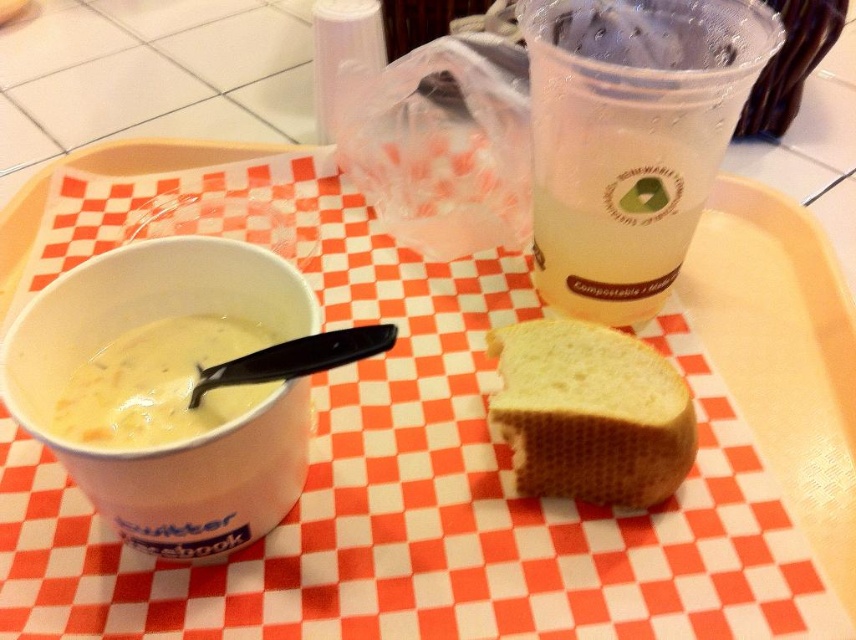
Looking at this image, you are a food delivery person who needs to place a new order on the tray. The new order requires that the distance between the golden brown crusty bread at center and the white creamy soup at left must be exactly 10 inches. Can you adjust the current arrangement to meet this requirement?

The golden brown crusty bread at center is currently 8.76 inches from the white creamy soup at left. To meet the requirement of 10 inches, you need to move them apart by an additional 1.24 inches.

You are trying to locate the clear plastic cup at upper right on the image. According to the coordinates, where is it placed?

The clear plastic cup at upper right is placed at the 2D location of point (629, 138).

You are a food delivery person who just received this meal. You need to check if the clear plastic cup at upper right and the golden brown crusty bread at center are arranged in a way that the bread is not blocking the cup. Can you confirm this?

The clear plastic cup at upper right is closer to the viewer than golden brown crusty bread at center, so the bread is behind the cup and not blocking it.